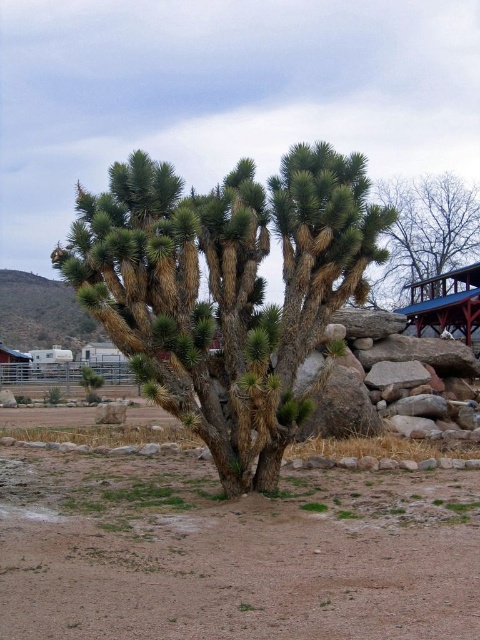
You are standing at the base of the Joshua tree in the desert scene. You notice two points marked on the ground. One is at coordinates point (417, 500) and the other at point (416, 179). If you were to walk towards the blue roofed building visible to the right, which point would you step on first?

Point (417, 500) is in front of point (416, 179), so you would step on point (417, 500) first when walking towards the blue roofed building.

You are standing at the center of the image and want to walk towards the structure with a blue roof and red supports visible to the right. Which direction should you move relative to the brown sandy dirt at center?

Since the structure with a blue roof and red supports is visible to the right side of the image, you should move towards the right direction relative to the brown sandy dirt at center.

You are a hiker trying to navigate through the desert. You see a green spiky tree at center and brown sandy dirt at center. Which one would you choose to walk on and why?

You should walk on the brown sandy dirt at center because it is smaller than the green spiky tree at center, making it a safer and more stable surface for walking.